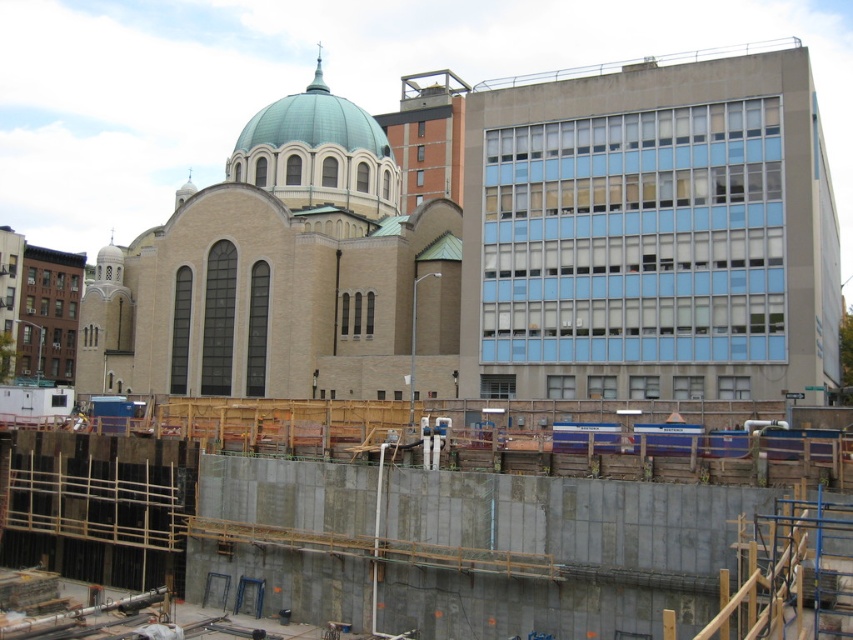
Is beige stone church at center thinner than concrete wall at center?

In fact, beige stone church at center might be wider than concrete wall at center.

Between point (573, 305) and point (337, 401), which one is positioned behind?

The point (337, 401) is more distant.

The height and width of the screenshot is (640, 853). Identify the location of beige stone church at center. (497, 248).

Where is `beige stone church at center`? The height and width of the screenshot is (640, 853). beige stone church at center is located at coordinates (497, 248).